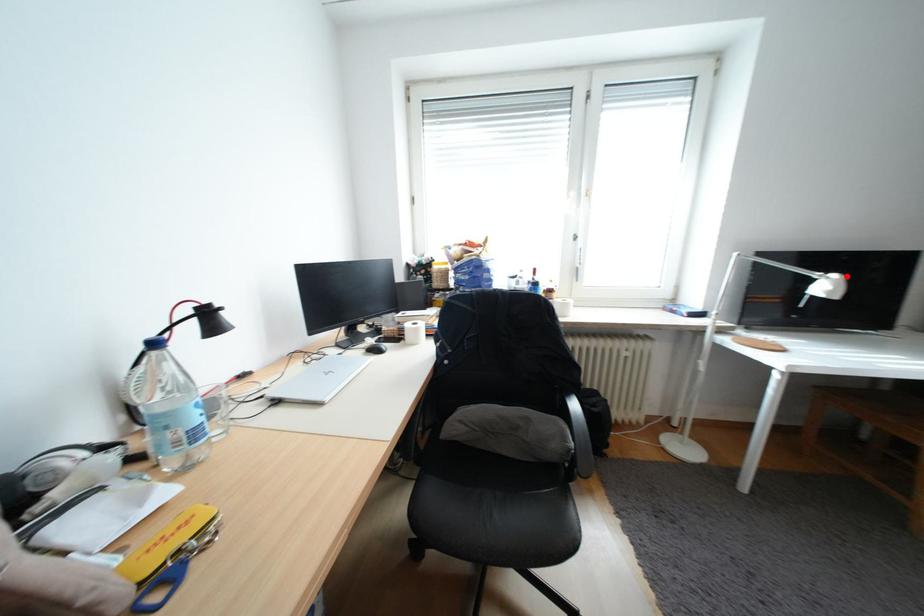
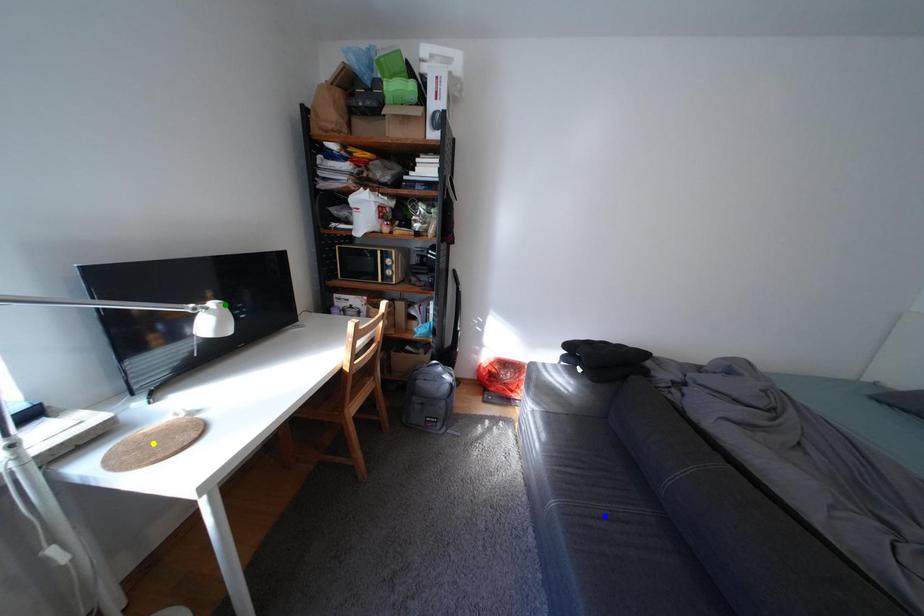
Question: I am providing you with two images of the same scene from different viewpoints. A red point is marked on the first image. You are given multiple points on the second image. Can you choose the point in image 2 that corresponds to the point in image 1?

Choices:
 (A) blue point
 (B) yellow point
 (C) green point

Answer: (C)